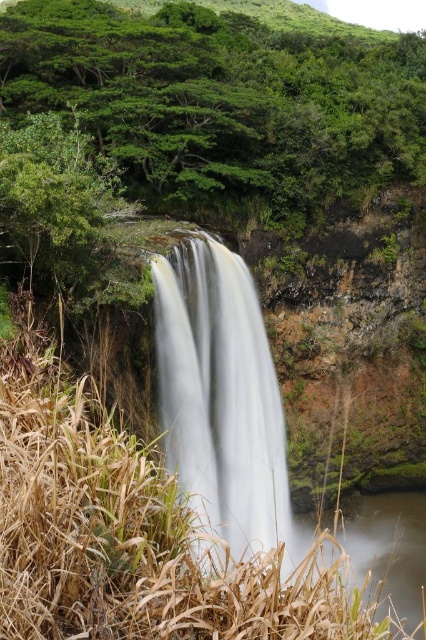
Is point (238, 540) less distant than point (420, 492)?

Yes, it is in front of point (420, 492).

Is point (190, 353) more distant than point (391, 556)?

That is False.

Locate an element on the screen. white smooth waterfall at center is located at coordinates (221, 397).

Locate an element on the screen. white smooth waterfall at center is located at coordinates (221, 397).

Does point (37, 104) come in front of point (308, 524)?

Yes, it is in front of point (308, 524).

Who is more distant from viewer, (100, 20) or (342, 545)?

The point (100, 20) is behind.

The height and width of the screenshot is (640, 426). What are the coordinates of `green leafy trees at upper left` in the screenshot? It's located at (224, 99).

Can you confirm if green leafy trees at upper left is positioned to the right of white smooth waterfall at center?

Yes, green leafy trees at upper left is to the right of white smooth waterfall at center.

Based on the photo, does green leafy trees at upper left come behind white smooth waterfall at center?

That is True.

Where is `green leafy trees at upper left`? The image size is (426, 640). green leafy trees at upper left is located at coordinates (224, 99).

At what (x,y) coordinates should I click in order to perform the action: click on green leafy trees at upper left. Please return your answer as a coordinate pair (x, y). Image resolution: width=426 pixels, height=640 pixels. Looking at the image, I should click on pos(224,99).